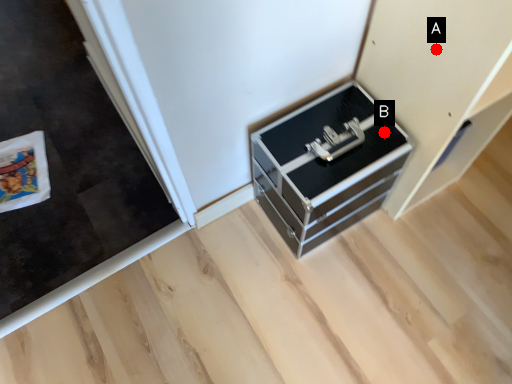
Question: Two points are circled on the image, labeled by A and B beside each circle. Which point is further to the camera?

Choices:
 (A) A is further
 (B) B is further

Answer: (B)